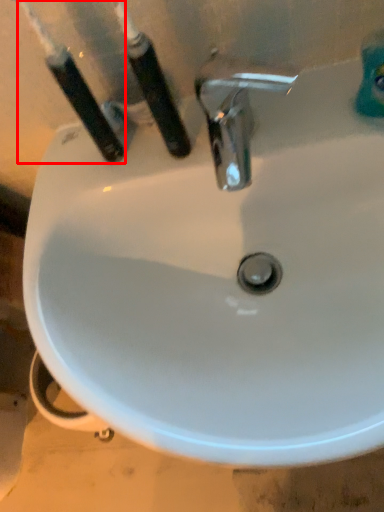
Question: From the image's perspective, considering the relative positions of toothbrush (annotated by the red box) and toothbrush in the image provided, where is toothbrush (annotated by the red box) located with respect to the staircase?

Choices:
 (A) below
 (B) above

Answer: (B)